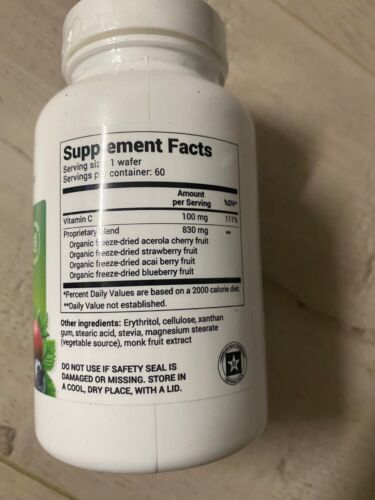
Identify the location of bottle. (92, 150).